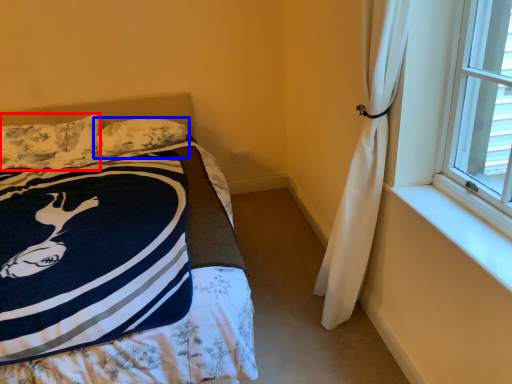
Question: Which point is closer to the camera, pillow (highlighted by a red box) or pillow (highlighted by a blue box)?

Choices:
 (A) pillow
 (B) pillow

Answer: (A)